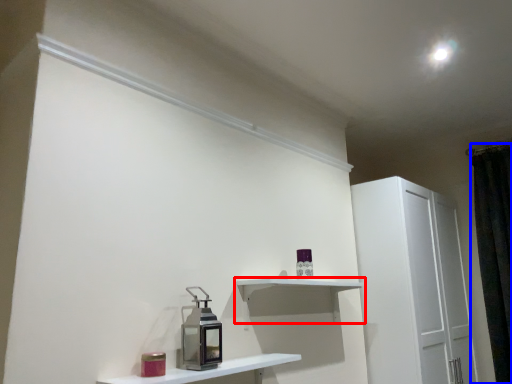
Question: Which object appears closest to the camera in this image, shelf (highlighted by a red box) or curtain (highlighted by a blue box)?

Choices:
 (A) shelf
 (B) curtain

Answer: (A)